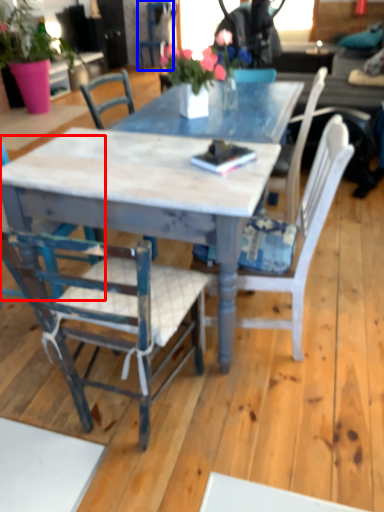
Question: Which of the following is the closest to the observer, chair (highlighted by a red box) or chair (highlighted by a blue box)?

Choices:
 (A) chair
 (B) chair

Answer: (A)